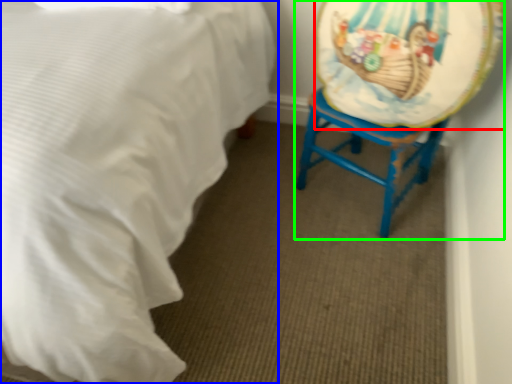
Question: Based on their relative distances, which object is nearer to platter (highlighted by a red box)? Choose from bed (highlighted by a blue box) and swivel chair (highlighted by a green box).

Choices:
 (A) bed
 (B) swivel chair

Answer: (B)